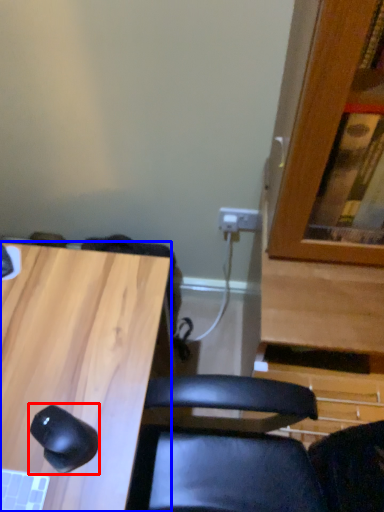
Question: Which of the following is the farthest to the observer, mouse (highlighted by a red box) or desk (highlighted by a blue box)?

Choices:
 (A) mouse
 (B) desk

Answer: (A)